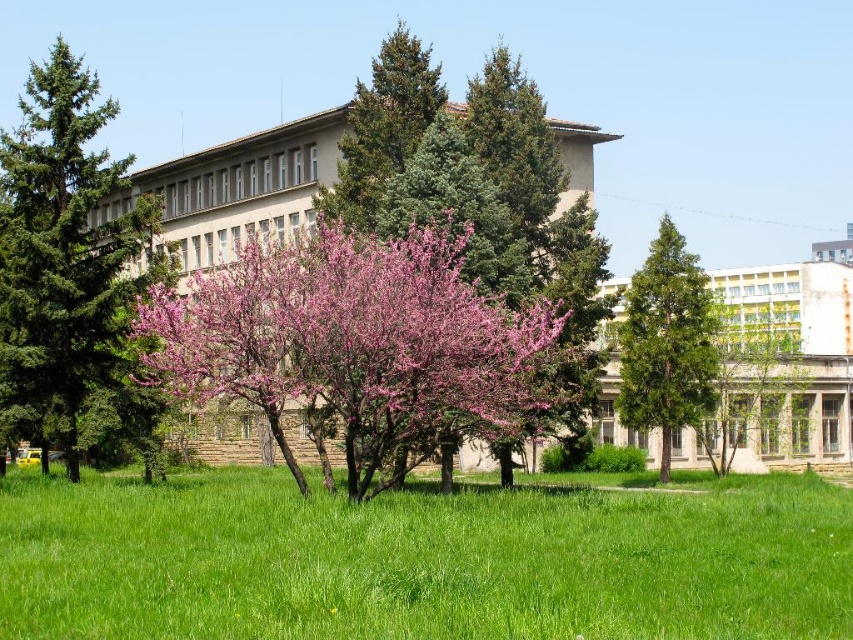
Question: Does green textured tree at left have a smaller size compared to green textured tree at upper center?

Choices:
 (A) yes
 (B) no

Answer: (B)

Question: Among these points, which one is nearest to the camera?

Choices:
 (A) (653, 365)
 (B) (115, 323)
 (C) (350, 385)

Answer: (C)

Question: Estimate the real-world distances between objects in this image. Which object is closer to the pink bloom at center?

Choices:
 (A) green textured tree at left
 (B) green matte tree at center
 (C) green textured tree at upper center

Answer: (C)

Question: Observing the image, what is the correct spatial positioning of pink bloom at center in reference to green textured tree at left?

Choices:
 (A) right
 (B) left

Answer: (A)

Question: Can you confirm if green matte tree at center is thinner than green textured tree at upper center?

Choices:
 (A) yes
 (B) no

Answer: (A)

Question: Which point is farther to the camera?

Choices:
 (A) (387, 170)
 (B) (672, 339)
 (C) (64, 81)

Answer: (B)